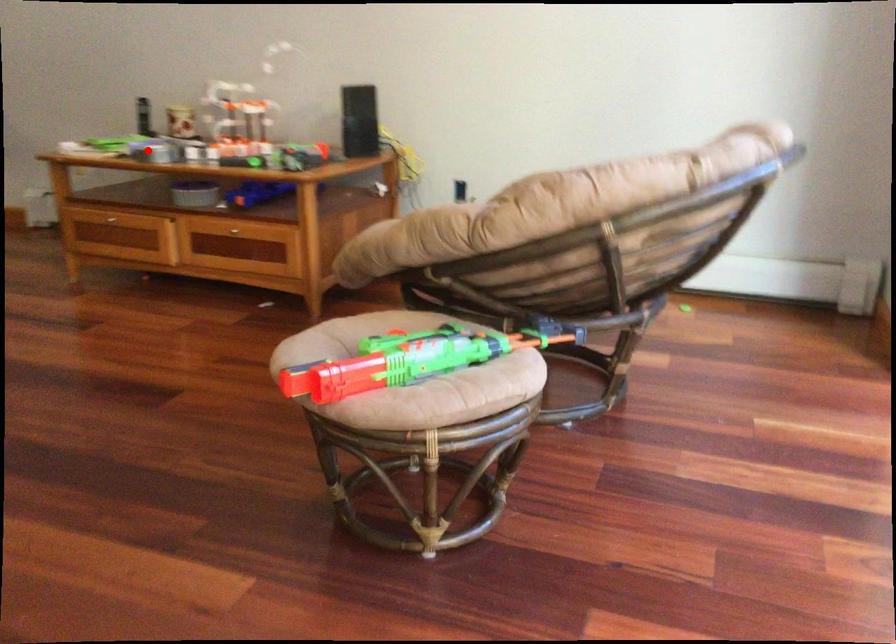
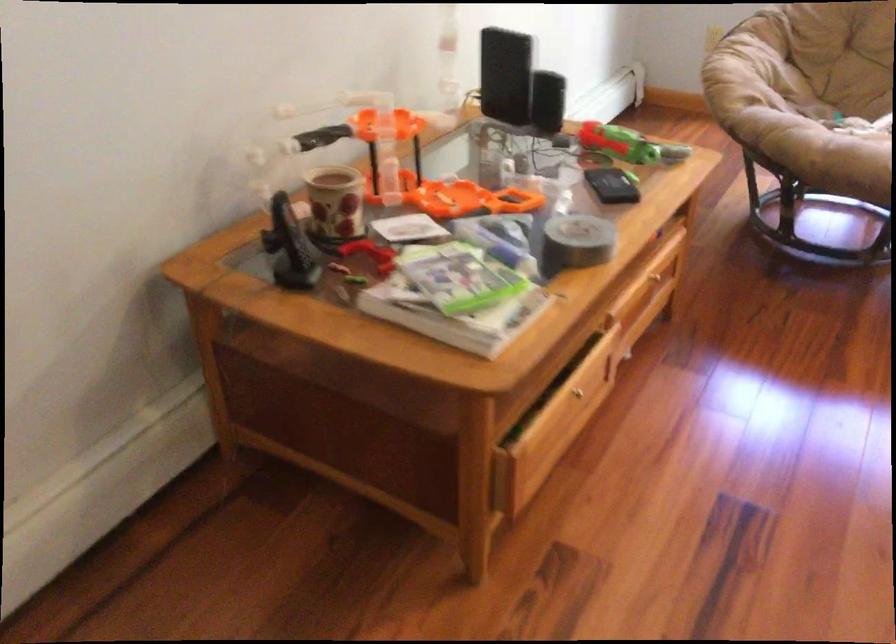
Question: I am providing you with two images of the same scene from different viewpoints. Image1 has a red point marked. In image2, the corresponding 3D location appears at what relative position? Reply with the corresponding letter.

Choices:
 (A) Closer
 (B) Farther

Answer: (A)